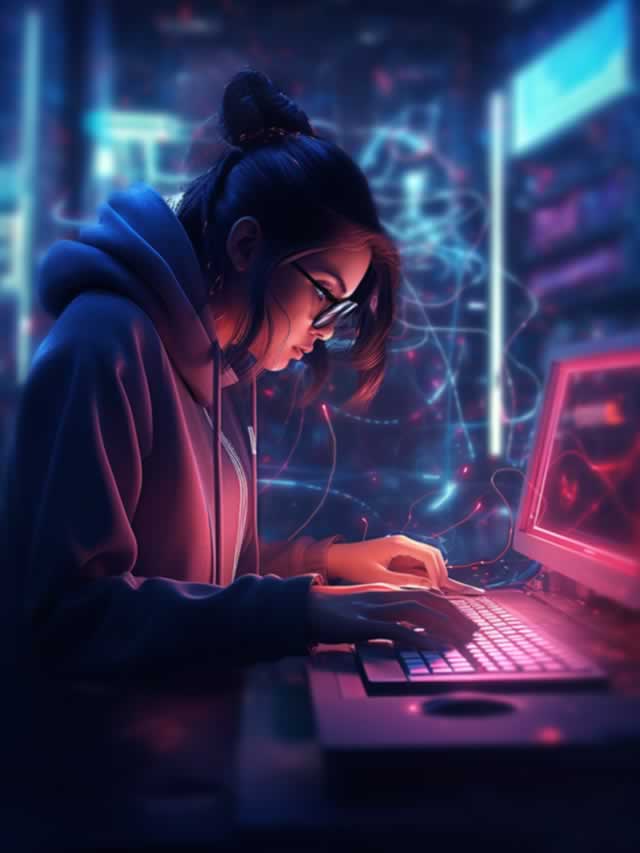
Where is `neon blue light in background`? The width and height of the screenshot is (640, 853). neon blue light in background is located at coordinates 105,141, 575,106, 498,273, 413,199, 22,171, 448,494, 283,482.